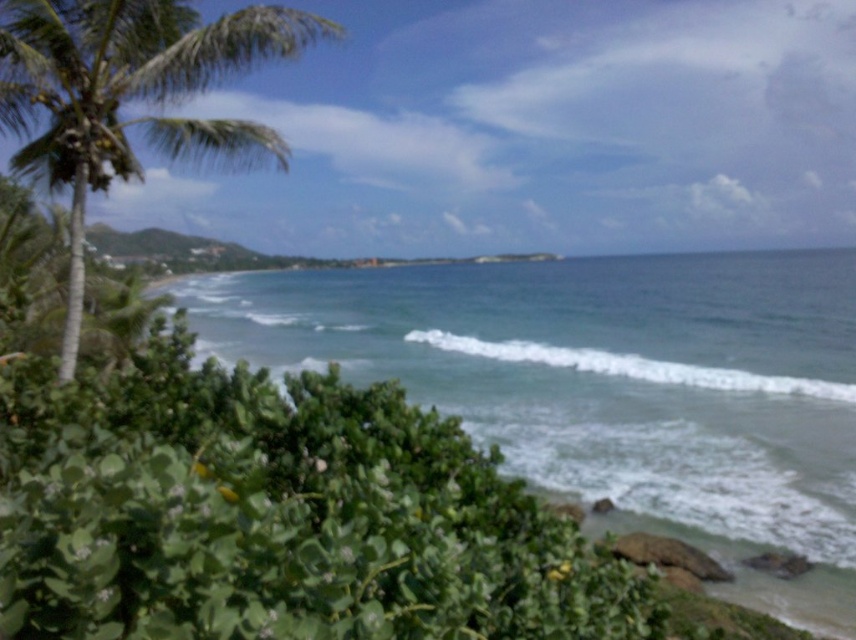
Question: Does green leafy palm tree at left appear over white frothy wave at center?

Choices:
 (A) no
 (B) yes

Answer: (B)

Question: Which point is closer to the camera?

Choices:
 (A) white frothy wave at center
 (B) green leafy palm tree at left
 (C) green leafy water at lower left

Answer: (B)

Question: Observing the image, what is the correct spatial positioning of green leafy water at lower left in reference to white frothy wave at center?

Choices:
 (A) right
 (B) left

Answer: (B)

Question: Among these points, which one is nearest to the camera?

Choices:
 (A) (563, 362)
 (B) (703, 419)

Answer: (B)

Question: Is green leafy palm tree at left wider than white frothy wave at center?

Choices:
 (A) yes
 (B) no

Answer: (B)

Question: Which point is farther from the camera taking this photo?

Choices:
 (A) (242, 60)
 (B) (810, 298)

Answer: (B)